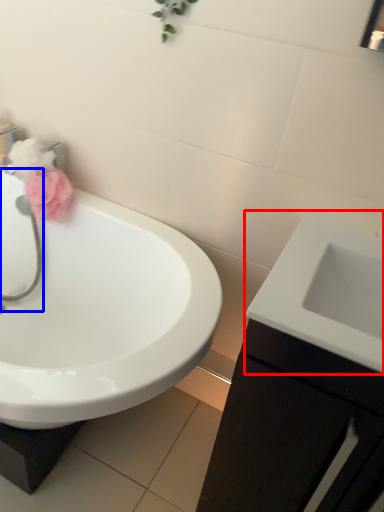
Question: Which object is closer to the camera taking this photo, sink (highlighted by a red box) or plumbing fixture (highlighted by a blue box)?

Choices:
 (A) sink
 (B) plumbing fixture

Answer: (A)